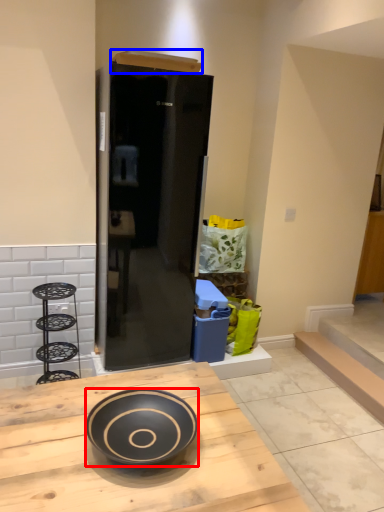
Question: Which object is closer to the camera taking this photo, bowl (highlighted by a red box) or box (highlighted by a blue box)?

Choices:
 (A) bowl
 (B) box

Answer: (A)